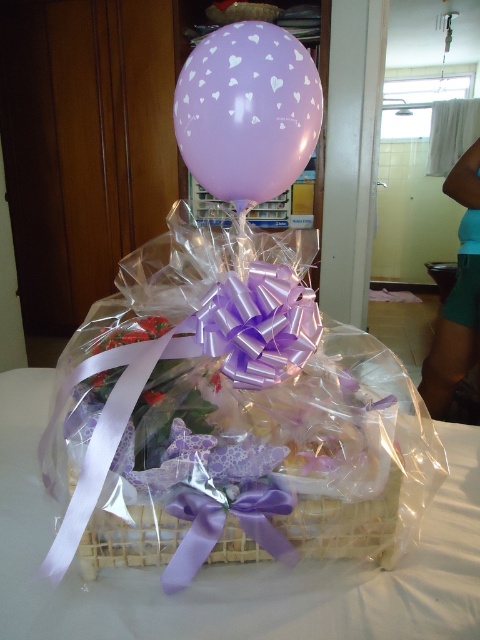
Question: Which point is farther to the camera?

Choices:
 (A) translucent plastic basket at center
 (B) lavender matte balloon at upper center

Answer: (B)

Question: Is translucent plastic basket at center bigger than lavender matte balloon at upper center?

Choices:
 (A) no
 (B) yes

Answer: (B)

Question: Is translucent plastic basket at center positioned in front of lavender matte balloon at upper center?

Choices:
 (A) no
 (B) yes

Answer: (B)

Question: Which of the following is the closest to the observer?

Choices:
 (A) translucent plastic basket at center
 (B) lavender matte balloon at upper center

Answer: (A)

Question: Is translucent plastic basket at center thinner than lavender matte balloon at upper center?

Choices:
 (A) yes
 (B) no

Answer: (B)